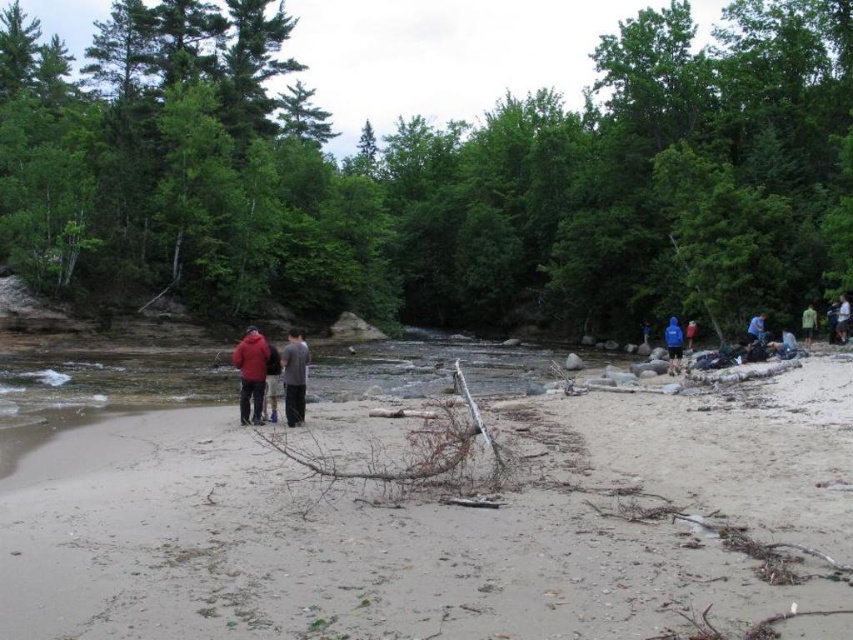
You are standing on the riverbank and see a person wearing a white cotton shirt at right. If you want to wave to them, do you think you can do it without shouting? Explain your reasoning.

The white cotton shirt at right and viewer are 30.76 meters apart. Since 30.76 meters is a considerable distance, waving might not be visible, so shouting would likely be necessary to communicate effectively.

You are a hiker who wants to cross the shallow river. You have two shirts with you, the white cotton shirt at right and the green fabric shirt at right. Which shirt would be more suitable to use as a makeshift sandal to protect your feet from sharp rocks?

The white cotton shirt at right is thinner than the green fabric shirt at right, so the green fabric shirt at right would be more suitable as a makeshift sandal since thicker fabric provides better protection against sharp rocks.